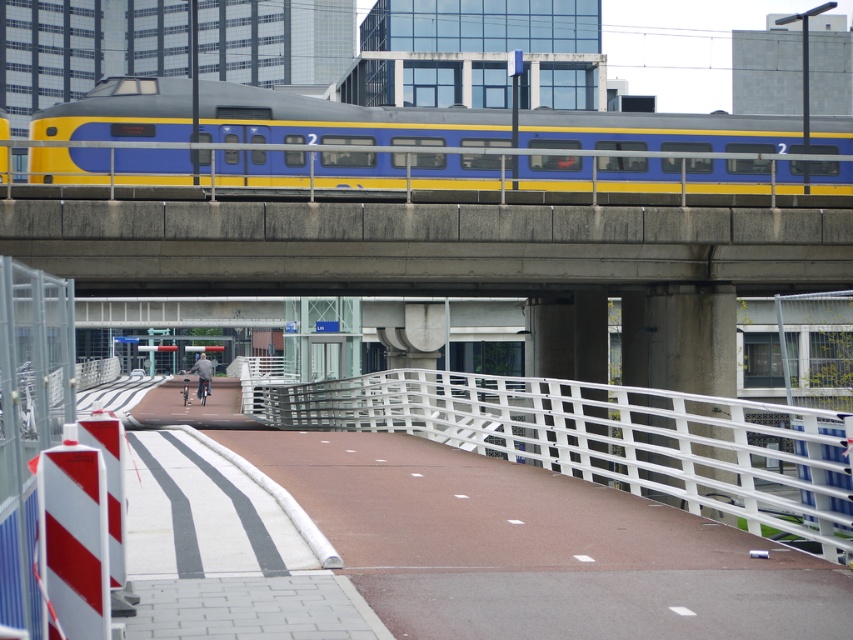
You are standing at the origin point of the coordinate system, which is at the bottom left corner of the image. The yellow blue painted train at upper center is located at point (486, 147). If you want to walk towards the yellow blue painted train at upper center, in which direction should you move?

You should move northeast to reach the yellow blue painted train at upper center, as it is located at point (486, 147) from the origin at the bottom left corner.

You are standing at the train station and looking at the bridge. There are two points marked on the bridge structure. The first point is at coordinate point [67,156] and the second is at point [418,381]. Which point is closer to you?

Point [67,156] is further to the camera than point [418,381], so the point closer to you is point [418,381].